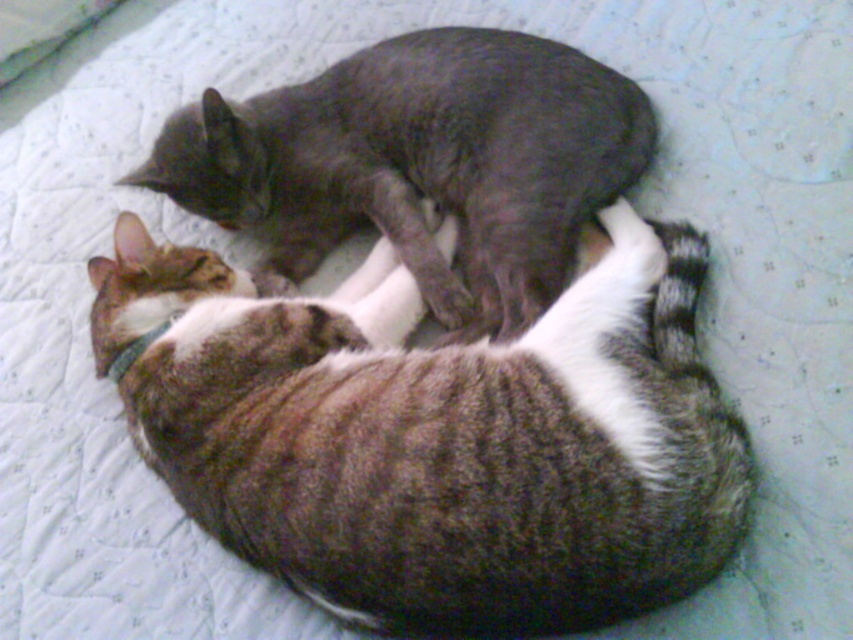
Question: Considering the relative positions of tabby fur cat at lower center and gray smooth cat at upper center in the image provided, where is tabby fur cat at lower center located with respect to gray smooth cat at upper center?

Choices:
 (A) right
 (B) left

Answer: (A)

Question: Which object appears farthest from the camera in this image?

Choices:
 (A) gray smooth cat at upper center
 (B) tabby fur cat at lower center

Answer: (A)

Question: Is tabby fur cat at lower center above gray smooth cat at upper center?

Choices:
 (A) yes
 (B) no

Answer: (B)

Question: Where is tabby fur cat at lower center located in relation to gray smooth cat at upper center in the image?

Choices:
 (A) above
 (B) below

Answer: (B)

Question: Which of the following is the closest to the observer?

Choices:
 (A) (160, 456)
 (B) (434, 198)

Answer: (A)